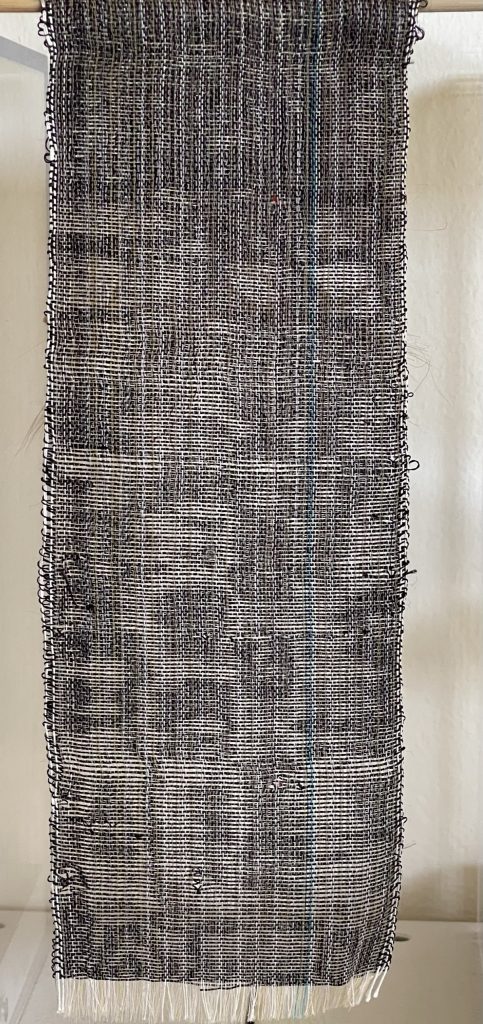
You are a GUI agent. You are given a task and a screenshot of the screen. Output one action in this format:
    pyautogui.click(x=<x>, y=<y>)
    Task: Click on the sewn tapestry
    
    Given the screenshot: What is the action you would take?
    pyautogui.click(x=91, y=950), pyautogui.click(x=89, y=923), pyautogui.click(x=233, y=929), pyautogui.click(x=325, y=933), pyautogui.click(x=346, y=698), pyautogui.click(x=190, y=717), pyautogui.click(x=109, y=706)